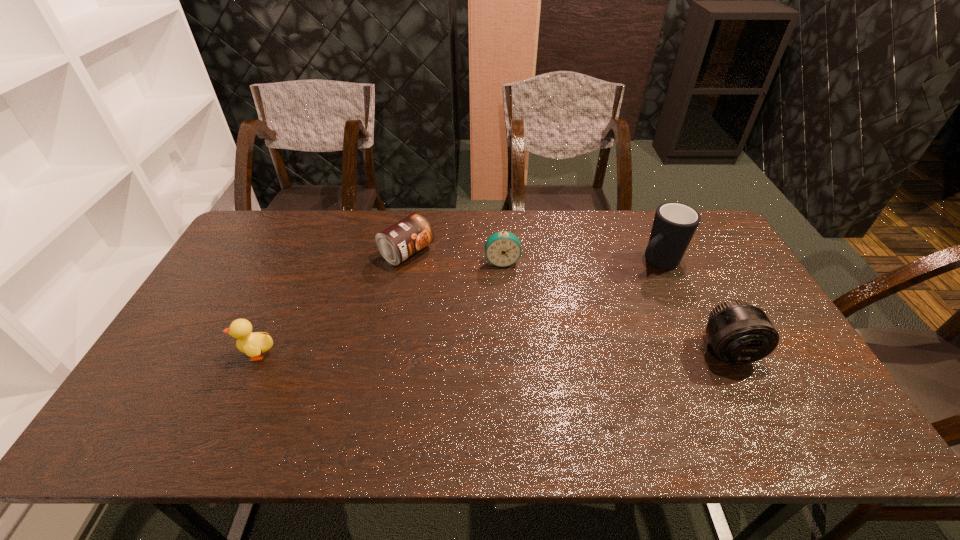
The width and height of the screenshot is (960, 540). I want to click on free space on the desktop that is between the leftmost object and the fourth shortest object and is positioned on the front-facing side of the third object from left to right, so click(x=514, y=352).

Image resolution: width=960 pixels, height=540 pixels. I want to click on vacant spot on the desktop that is between the duckling and the second tallest object and is positioned on the side of the mug with the handle, so click(x=529, y=352).

Find the location of a particular element. This screenshot has width=960, height=540. vacant space on the desktop that is between the duckling and the telephoto lens and is positioned on the front label of the can is located at coordinates (563, 352).